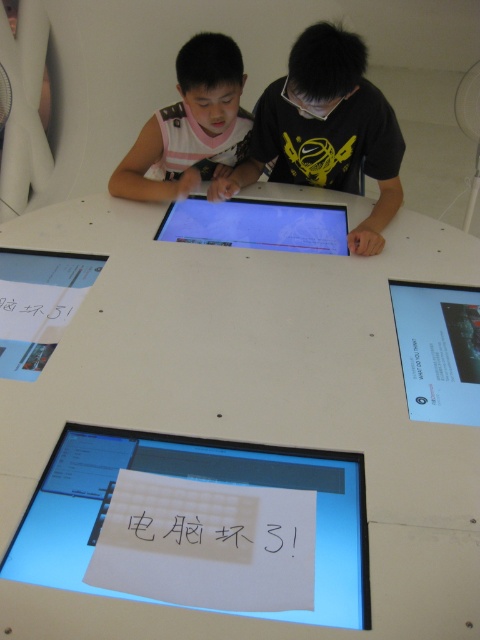
Between white matte table at center and white paper at bottom center, which one has less height?

With less height is white paper at bottom center.

Who is taller, white matte table at center or white paper at bottom center?

white matte table at center is taller.

Which is in front, point (333, 316) or point (155, 586)?

Point (155, 586) is in front.

You are a GUI agent. You are given a task and a screenshot of the screen. Output one action in this format:
    pyautogui.click(x=<x>, y=<y>)
    Task: Click on the white matte table at center
    Image resolution: width=480 pixels, height=640 pixels.
    Given the screenshot: What is the action you would take?
    pyautogui.click(x=237, y=420)

Based on the photo, between white paper at bottom center and white matte shirt at center, which one appears on the left side from the viewer's perspective?

white matte shirt at center

What do you see at coordinates (199, 488) in the screenshot? This screenshot has width=480, height=640. I see `white paper at bottom center` at bounding box center [199, 488].

Does point (81, 531) lie behind point (142, 172)?

No, it is not.

Find the location of `white paper at bottom center`. white paper at bottom center is located at coordinates (199, 488).

Can you confirm if white matte shirt at center is taller than matte black computer screen at upper right?

Yes, white matte shirt at center is taller than matte black computer screen at upper right.

Is white matte shirt at center thinner than matte black computer screen at upper right?

Incorrect, white matte shirt at center's width is not less than matte black computer screen at upper right's.

Is point (199, 99) positioned before point (478, 388)?

No.

Identify the location of white matte shirt at center. This screenshot has width=480, height=640. (191, 125).